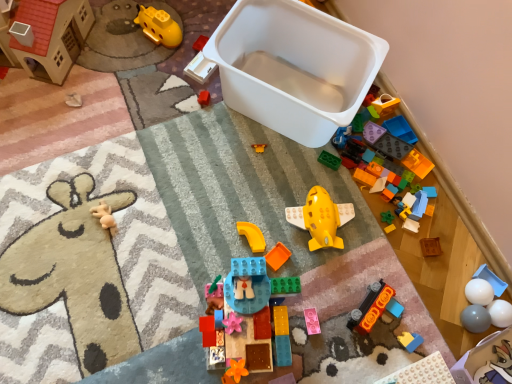
The height and width of the screenshot is (384, 512). I want to click on free area in between orange matte car at lower right, marked as the 9th toy in a left-to-right arrangement, and translucent blue plastic building block at center, the fifth toy viewed from the left, so click(323, 319).